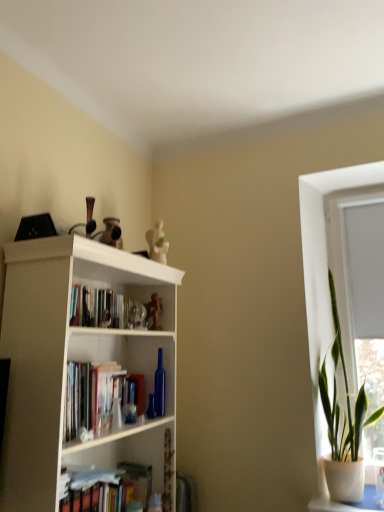
Question: From a real-world perspective, is hardcover books at center above or below white plastic window frame at upper right?

Choices:
 (A) above
 (B) below

Answer: (B)

Question: Considering the relative positions of hardcover books at center and white plastic window frame at upper right in the image provided, is hardcover books at center to the left or to the right of white plastic window frame at upper right?

Choices:
 (A) left
 (B) right

Answer: (A)

Question: Considering the real-world distances, which object is closest to the green leafy plant in pot at right?

Choices:
 (A) white plastic window frame at upper right
 (B) white matte bookcase at upper left
 (C) hardcover books at center

Answer: (A)

Question: Estimate the real-world distances between objects in this image. Which object is farther from the white plastic window frame at upper right?

Choices:
 (A) hardcover books at center
 (B) green leafy plant in pot at right
 (C) white matte bookcase at upper left

Answer: (C)